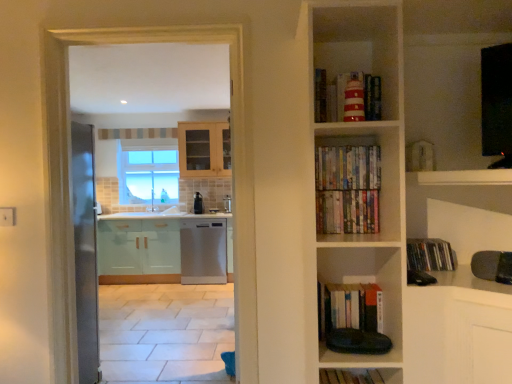
Question: Can you confirm if satin black dishwasher at center is bigger than multicolored paperbacks at center, the second book in the top-to-bottom sequence?

Choices:
 (A) yes
 (B) no

Answer: (A)

Question: From the image's perspective, does satin black dishwasher at center appear higher than multicolored paperbacks at center, the second book in the top-to-bottom sequence?

Choices:
 (A) yes
 (B) no

Answer: (B)

Question: Can you confirm if satin black dishwasher at center is wider than multicolored paperbacks at center, the second book in the top-to-bottom sequence?

Choices:
 (A) yes
 (B) no

Answer: (A)

Question: From a real-world perspective, is satin black dishwasher at center on multicolored paperbacks at center, the second book in the top-to-bottom sequence?

Choices:
 (A) yes
 (B) no

Answer: (B)

Question: Is satin black dishwasher at center oriented away from multicolored paperbacks at center, the second book in the top-to-bottom sequence?

Choices:
 (A) no
 (B) yes

Answer: (A)

Question: Considering the relative positions of striped paper lighthouse at upper center, the first book when ordered from top to bottom, and satin white dishwasher at center in the image provided, is striped paper lighthouse at upper center, the first book when ordered from top to bottom, to the left or to the right of satin white dishwasher at center?

Choices:
 (A) left
 (B) right

Answer: (B)

Question: Do you think striped paper lighthouse at upper center, which is the 6th book in bottom-to-top order, is within satin white dishwasher at center, or outside of it?

Choices:
 (A) inside
 (B) outside

Answer: (B)

Question: From a real-world perspective, relative to satin white dishwasher at center, is striped paper lighthouse at upper center, which is the 6th book in bottom-to-top order, vertically above or below?

Choices:
 (A) below
 (B) above

Answer: (B)

Question: Looking at the image, does striped paper lighthouse at upper center, which is the 6th book in bottom-to-top order, seem bigger or smaller compared to satin white dishwasher at center?

Choices:
 (A) big
 (B) small

Answer: (B)

Question: Is satin white dishwasher at center wider or thinner than multicolored paperbacks at center, the third book when ordered from top to bottom?

Choices:
 (A) thin
 (B) wide

Answer: (B)

Question: Considering their positions, is satin white dishwasher at center located in front of or behind multicolored paperbacks at center, which is the 4th book from bottom to top?

Choices:
 (A) front
 (B) behind

Answer: (B)

Question: Based on their sizes in the image, would you say satin white dishwasher at center is bigger or smaller than multicolored paperbacks at center, the third book when ordered from top to bottom?

Choices:
 (A) small
 (B) big

Answer: (B)

Question: From a real-world perspective, relative to multicolored paperbacks at center, the third book when ordered from top to bottom, is satin white dishwasher at center vertically above or below?

Choices:
 (A) below
 (B) above

Answer: (A)

Question: Would you say hardcover books at center, which is the second book from bottom to top, is to the left or to the right of multicolored paperbacks at center, marked as the 5th book in a bottom-to-top arrangement, in the picture?

Choices:
 (A) right
 (B) left

Answer: (A)

Question: Considering the positions of point (337, 322) and point (371, 170), is point (337, 322) closer or farther from the camera than point (371, 170)?

Choices:
 (A) closer
 (B) farther

Answer: (B)